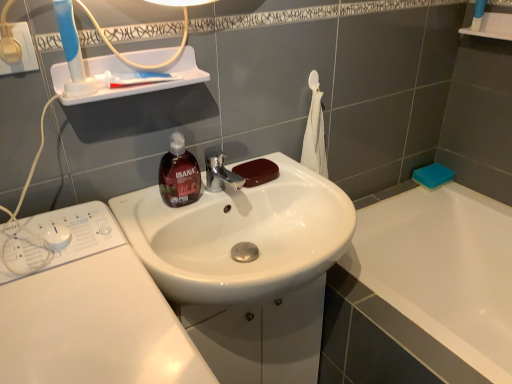
In order to face white glossy washing machine at lower left, should I rotate leftwards or rightwards?

A 20.876 degree turn to the left will do.

Measure the distance between point (181, 373) and camera.

Point (181, 373) and camera are 21.46 inches apart.

What do you see at coordinates (257, 172) in the screenshot? The width and height of the screenshot is (512, 384). I see `brown matte soap at sink, which is the first soap in front-to-back order` at bounding box center [257, 172].

This screenshot has height=384, width=512. Describe the element at coordinates (240, 236) in the screenshot. I see `white glossy sink at center` at that location.

Identify the location of blue plastic toothbrush at upper left. The image size is (512, 384). (72, 51).

Is white glossy sink at center oriented away from white glossy washing machine at lower left?

No.

Considering the positions of objects white glossy sink at center and white glossy washing machine at lower left in the image provided, who is behind, white glossy sink at center or white glossy washing machine at lower left?

white glossy sink at center is behind.

Can you tell me how much white glossy sink at center and white glossy washing machine at lower left differ in facing direction?

1.32 degrees separate the facing orientations of white glossy sink at center and white glossy washing machine at lower left.

Considering the sizes of objects white glossy sink at center and white glossy washing machine at lower left in the image provided, who is smaller, white glossy sink at center or white glossy washing machine at lower left?

Result: white glossy sink at center is smaller.

Between point (198, 356) and point (69, 38), which one is positioned in front?

The point (198, 356) is in front.

Is blue plastic toothbrush at upper left at the back of white glossy washing machine at lower left?

No, white glossy washing machine at lower left's orientation is not away from blue plastic toothbrush at upper left.

Would you say white glossy washing machine at lower left is inside or outside blue plastic toothbrush at upper left?

white glossy washing machine at lower left is located beyond the bounds of blue plastic toothbrush at upper left.

Which of these two, white glossy washing machine at lower left or blue plastic toothbrush at upper left, is smaller?

Smaller between the two is blue plastic toothbrush at upper left.

Are blue plastic toothbrush at upper left and white glossy washing machine at lower left located far from each other?

Actually, blue plastic toothbrush at upper left and white glossy washing machine at lower left are a little close together.

Considering the sizes of blue plastic toothbrush at upper left and white glossy washing machine at lower left in the image, is blue plastic toothbrush at upper left wider or thinner than white glossy washing machine at lower left?

Clearly, blue plastic toothbrush at upper left has less width compared to white glossy washing machine at lower left.

Which object is positioned more to the left, blue plastic toothbrush at upper left or white glossy washing machine at lower left?

blue plastic toothbrush at upper left.

Who is taller, blue plastic toothbrush at upper left or white glossy washing machine at lower left?

white glossy washing machine at lower left.

Which is correct: blue sponge at right, the second soap positioned from the front, is inside blue plastic toothbrush at upper left, or outside of it?

blue sponge at right, the second soap positioned from the front, is not enclosed by blue plastic toothbrush at upper left.

From the image's perspective, starting from the blue plastic toothbrush at upper left, which soap is the 1st one below? Please provide its 2D coordinates.

[(433, 176)]

Based on the photo, who is smaller, blue sponge at right, arranged as the second soap when viewed from the left, or blue plastic toothbrush at upper left?

blue plastic toothbrush at upper left.

Is translucent brown soap dispenser at center to the left of blue plastic toothbrush at upper left from the viewer's perspective?

No.

Is translucent brown soap dispenser at center wider than blue plastic toothbrush at upper left?

Indeed, translucent brown soap dispenser at center has a greater width compared to blue plastic toothbrush at upper left.

From a real-world perspective, which is physically above, translucent brown soap dispenser at center or blue plastic toothbrush at upper left?

blue plastic toothbrush at upper left, from a real-world perspective.

What's the angular difference between translucent brown soap dispenser at center and blue plastic toothbrush at upper left's facing directions?

4.52 degrees separate the facing orientations of translucent brown soap dispenser at center and blue plastic toothbrush at upper left.

Would you say brown matte soap at sink, positioned as the second soap in back-to-front order, is part of translucent brown soap dispenser at center's contents?

No, translucent brown soap dispenser at center does not contain brown matte soap at sink, positioned as the second soap in back-to-front order.

Is translucent brown soap dispenser at center aimed at brown matte soap at sink, which is the 1th soap from left to right?

No, translucent brown soap dispenser at center is not aimed at brown matte soap at sink, which is the 1th soap from left to right.

In terms of size, does translucent brown soap dispenser at center appear bigger or smaller than brown matte soap at sink, which is the first soap in front-to-back order?

In the image, translucent brown soap dispenser at center appears to be larger than brown matte soap at sink, which is the first soap in front-to-back order.

Is translucent brown soap dispenser at center in front of or behind brown matte soap at sink, the second soap viewed from the right, in the image?

Visually, translucent brown soap dispenser at center is located in front of brown matte soap at sink, the second soap viewed from the right.

Would you say translucent brown soap dispenser at center is part of white plastic socket at upper left's contents?

No, translucent brown soap dispenser at center is not a part of white plastic socket at upper left.

Looking at this image, is white plastic socket at upper left with translucent brown soap dispenser at center?

No, white plastic socket at upper left is not beside translucent brown soap dispenser at center.

Which object is further away from the camera, white plastic socket at upper left or translucent brown soap dispenser at center?

Positioned behind is translucent brown soap dispenser at center.

From the image's perspective, which object appears higher, white plastic socket at upper left or translucent brown soap dispenser at center?

From the image's view, white plastic socket at upper left is above.

The height and width of the screenshot is (384, 512). In order to click on washing machine in front of the white glossy sink at center in this screenshot , I will do `click(92, 313)`.

In the image, there is a blue plastic toothbrush at upper left. In order to click on washing machine below it (from a real-world perspective) in this screenshot , I will do pyautogui.click(x=92, y=313).

Looking at this image, considering their positions, is white glossy sink at center positioned further to white plastic socket at upper left than translucent brown soap dispenser at center?

white glossy sink at center lies further to white plastic socket at upper left than the other object.

Estimate the real-world distances between objects in this image. Which object is further from translucent brown soap dispenser at center, white glossy washing machine at lower left or white plastic socket at upper left?

The object further to translucent brown soap dispenser at center is white plastic socket at upper left.

Considering their positions, is translucent brown soap dispenser at center positioned further to blue plastic toothbrush at upper left than white plastic socket at upper left?

translucent brown soap dispenser at center is further to blue plastic toothbrush at upper left.

Looking at the image, which one is located further to brown matte soap at sink, positioned as the second soap in back-to-front order, blue sponge at right, which ranks as the first soap in back-to-front order, or white plastic socket at upper left?

blue sponge at right, which ranks as the first soap in back-to-front order, is further to brown matte soap at sink, positioned as the second soap in back-to-front order.

Which object lies nearer to the anchor point blue sponge at right, the second soap positioned from the front, white glossy washing machine at lower left or white plastic socket at upper left?

white glossy washing machine at lower left is closer to blue sponge at right, the second soap positioned from the front.

Considering their positions, is translucent brown soap dispenser at center positioned further to brown matte soap at sink, positioned as the second soap in back-to-front order, than white glossy sink at center?

Based on the image, white glossy sink at center appears to be further to brown matte soap at sink, positioned as the second soap in back-to-front order.

Considering their positions, is translucent brown soap dispenser at center positioned closer to white plastic socket at upper left than blue sponge at right, the first soap from the right?

translucent brown soap dispenser at center.

Considering their positions, is white glossy washing machine at lower left positioned further to brown matte soap at sink, which is the first soap in front-to-back order, than white glossy sink at center?

white glossy washing machine at lower left is further to brown matte soap at sink, which is the first soap in front-to-back order.

Where is `sink between white plastic socket at upper left and white glossy washing machine at lower left from top to bottom`? This screenshot has height=384, width=512. sink between white plastic socket at upper left and white glossy washing machine at lower left from top to bottom is located at coordinates (240, 236).

Find the location of a particular element. The width and height of the screenshot is (512, 384). electric outlet between blue plastic toothbrush at upper left and white glossy washing machine at lower left vertically is located at coordinates (21, 51).

The width and height of the screenshot is (512, 384). What are the coordinates of `electric outlet between blue plastic toothbrush at upper left and white glossy sink at center from top to bottom` in the screenshot? It's located at (21, 51).

You are a GUI agent. You are given a task and a screenshot of the screen. Output one action in this format:
    pyautogui.click(x=<x>, y=<y>)
    Task: Click on the sink between white glossy washing machine at lower left and translucent brown soap dispenser at center along the z-axis
    The width and height of the screenshot is (512, 384).
    Given the screenshot: What is the action you would take?
    pyautogui.click(x=240, y=236)